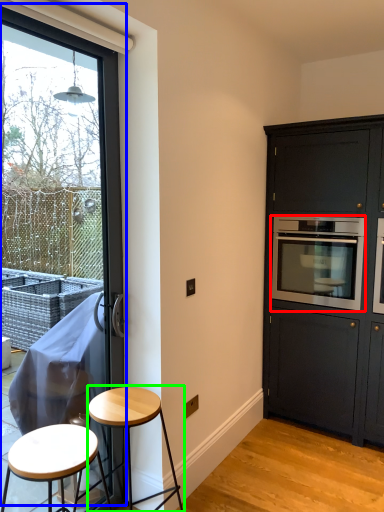
Question: Considering the real-world distances, which object is closest to oven (highlighted by a red box)? window (highlighted by a blue box) or stool (highlighted by a green box).

Choices:
 (A) window
 (B) stool

Answer: (A)